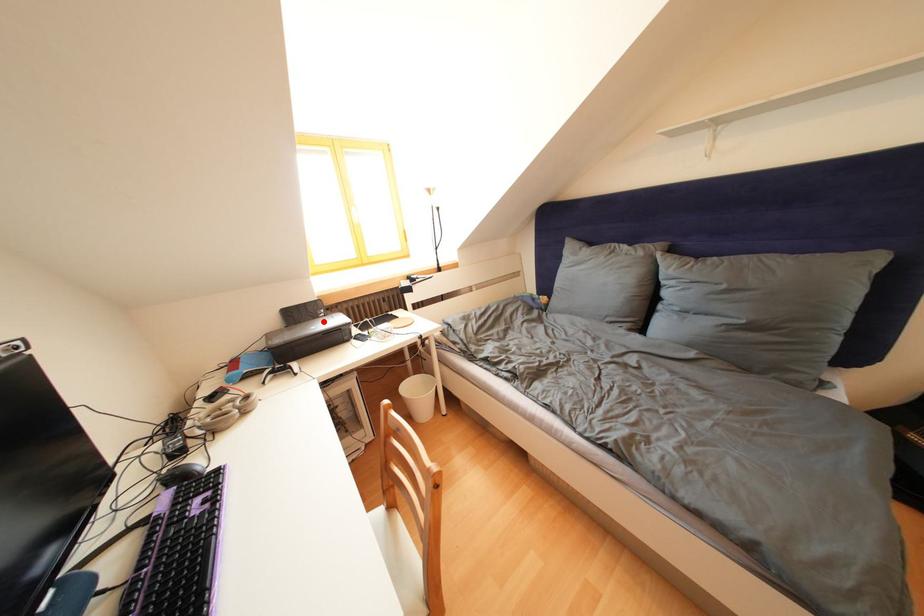
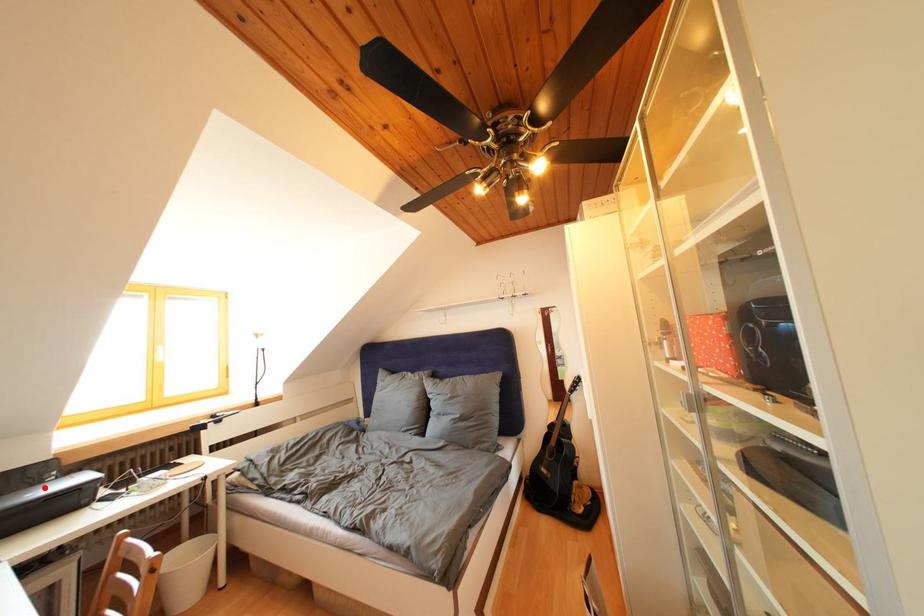
I am providing you with two images of the same scene from different viewpoints. A red point is marked on the first image and another point is marked on the second image. Is the marked point in image1 the same physical position as the marked point in image2?

Yes